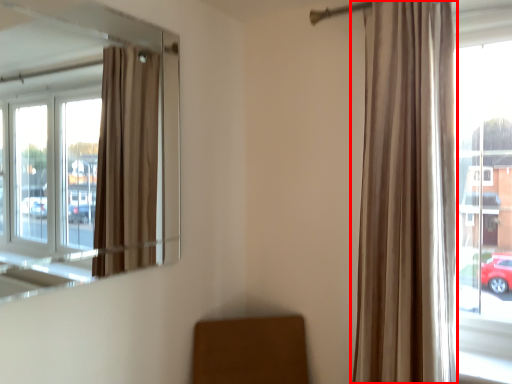
Question: From the image's perspective, where is curtain (annotated by the red box) located relative to window?

Choices:
 (A) below
 (B) above

Answer: (A)